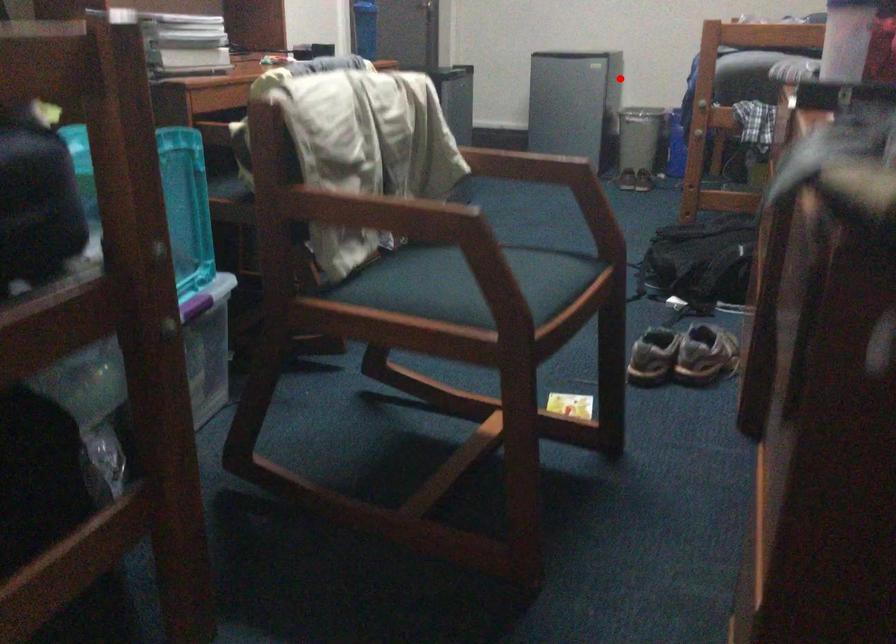
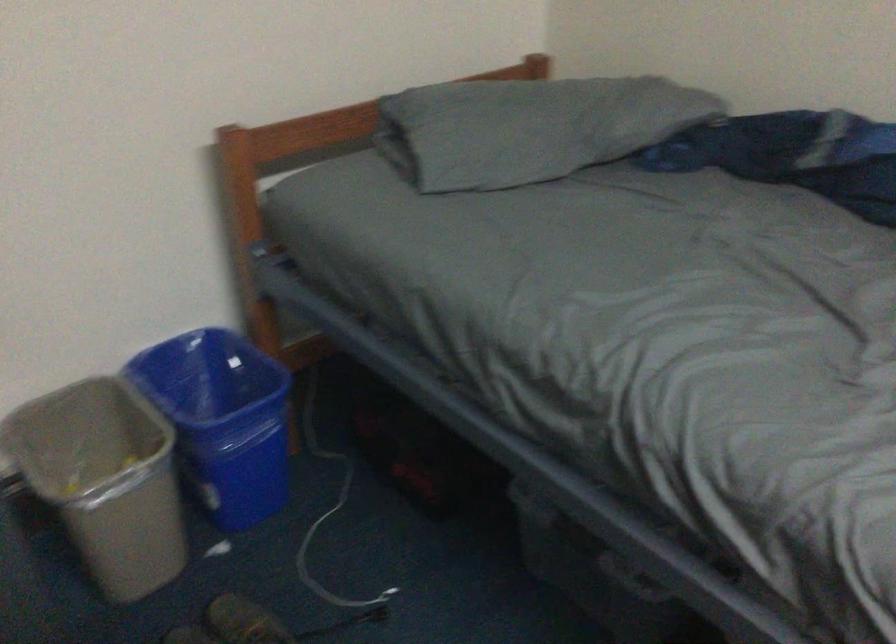
Question: I am providing you with two images of the same scene from different viewpoints. Given a red point in image1, look at the same physical point in image2. Is it:

Choices:
 (A) Closer to the viewpoint
 (B) Farther from the viewpoint

Answer: (A)